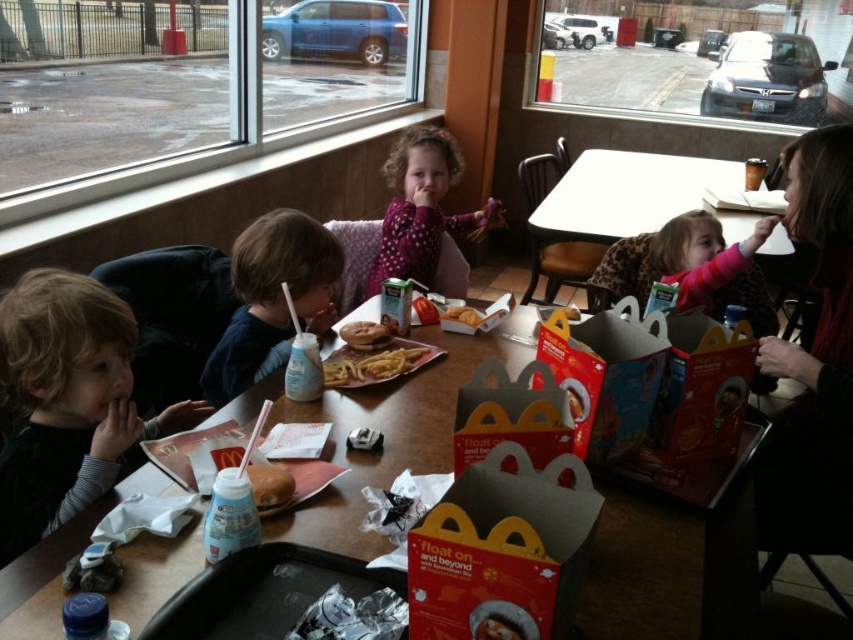
You are a parent at the McDonalds table with your kids. You see the yellow crispy french fries at center and the golden crispy chicken at center. Which one is closer to the edge of the table?

The yellow crispy french fries at center is below the golden crispy chicken at center, so it is closer to the edge of the table.

You are a parent at the McDonalds table. You want to grab the yellow crispy french fries at center to give to your child. Which direction should you move your hand from the white plastic table at upper center to reach the fries?

The white plastic table at upper center is positioned on the right side of yellow crispy french fries at center, so you should move your hand to the left from the white plastic table at upper center to reach the yellow crispy french fries at center.

You are a parent trying to hand a golden crispy chicken at center to your child wearing a pink dotted shirt at center. Can you place the chicken directly in front of the child without moving any other items on the table?

The pink dotted shirt at center has a greater height compared to golden crispy chicken at center, so the chicken can be placed directly in front of the child as it won not block the view or require moving other items.